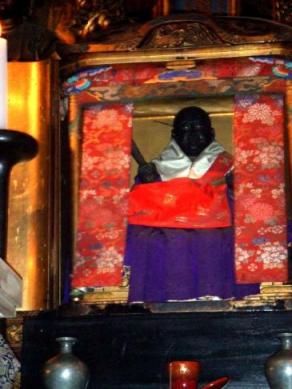
Find the location of `candle`. candle is located at coordinates (180, 373).